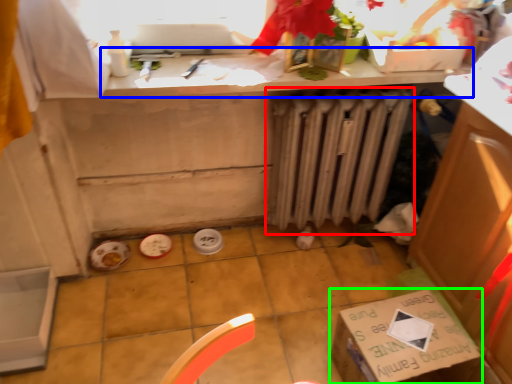
Question: Which object is the farthest from radiator (highlighted by a red box)? Choose among these: countertop (highlighted by a blue box) or cardboard box (highlighted by a green box).

Choices:
 (A) countertop
 (B) cardboard box

Answer: (B)